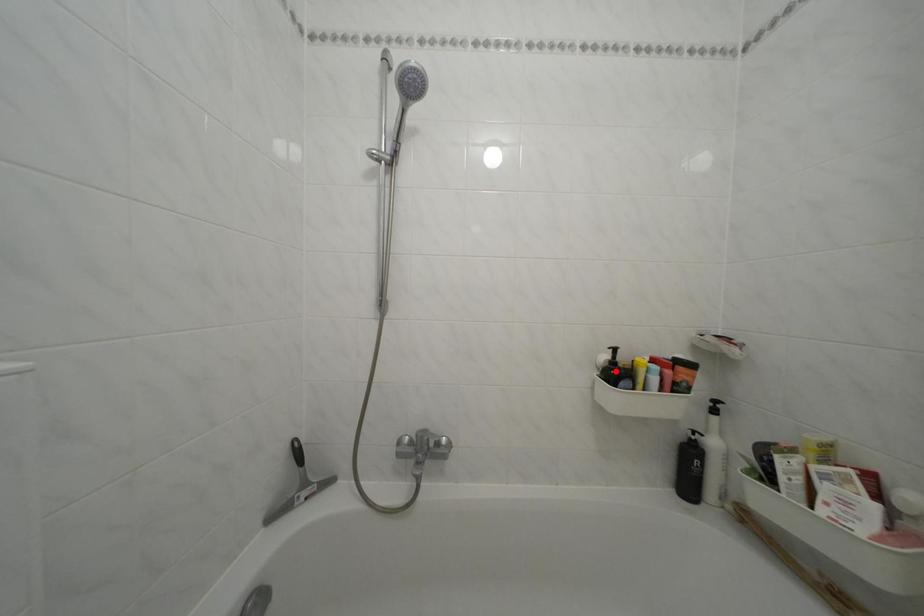
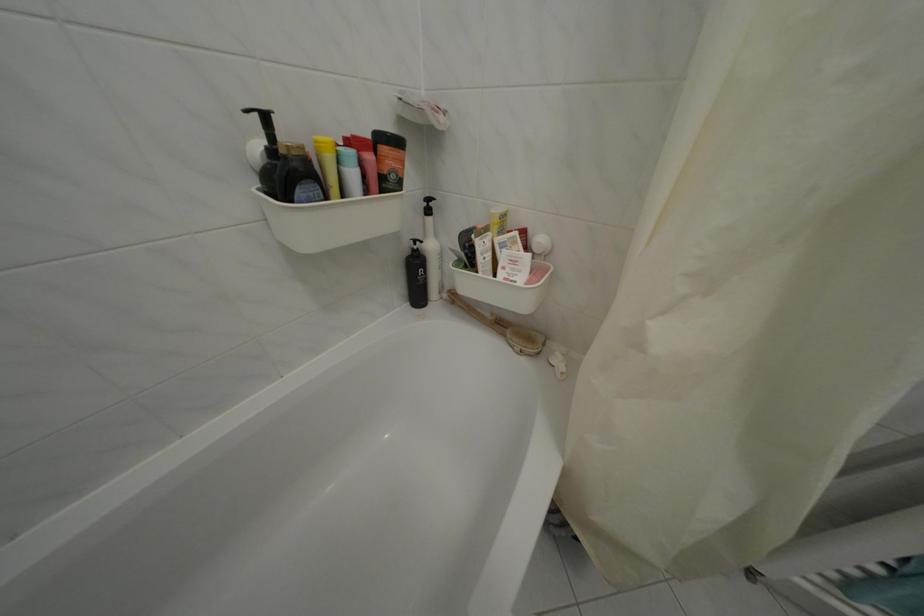
Question: I am providing you with two images of the same scene from different viewpoints. A red point is marked on the first image. Is the red point's position out of view in image 2?

Choices:
 (A) Yes
 (B) No

Answer: (B)